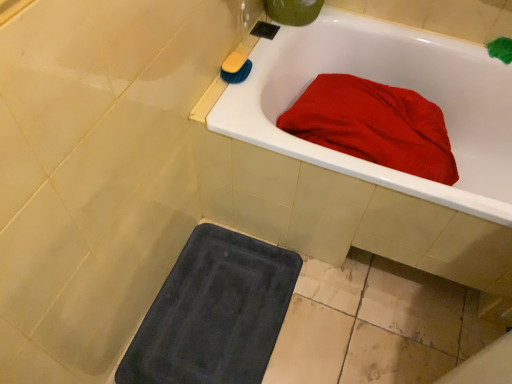
Question: Is yellow sponge at upper left inside the boundaries of matte white bathtub at upper right, or outside?

Choices:
 (A) outside
 (B) inside

Answer: (A)

Question: Considering their positions, is yellow sponge at upper left located in front of or behind matte white bathtub at upper right?

Choices:
 (A) behind
 (B) front

Answer: (A)

Question: From a real-world perspective, is yellow sponge at upper left positioned above or below matte white bathtub at upper right?

Choices:
 (A) below
 (B) above

Answer: (B)

Question: From the image's perspective, is matte white bathtub at upper right above or below yellow sponge at upper left?

Choices:
 (A) below
 (B) above

Answer: (A)

Question: Is matte white bathtub at upper right taller or shorter than yellow sponge at upper left?

Choices:
 (A) short
 (B) tall

Answer: (B)

Question: Is matte white bathtub at upper right bigger or smaller than yellow sponge at upper left?

Choices:
 (A) small
 (B) big

Answer: (B)

Question: Considering the positions of matte white bathtub at upper right and yellow sponge at upper left in the image, is matte white bathtub at upper right wider or thinner than yellow sponge at upper left?

Choices:
 (A) wide
 (B) thin

Answer: (A)